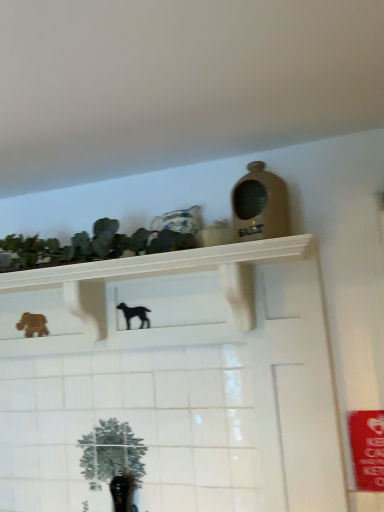
Where is `white glossy shelf at upper center`? The height and width of the screenshot is (512, 384). white glossy shelf at upper center is located at coordinates (144, 298).

What do you see at coordinates (134, 314) in the screenshot? Image resolution: width=384 pixels, height=512 pixels. I see `black matte dog at center, which is counted as the first animal, starting from the front` at bounding box center [134, 314].

What is the approximate width of green matte cactus at upper left?

The width of green matte cactus at upper left is 16.89 centimeters.

At what (x,y) coordinates should I click in order to perform the action: click on white glossy shelf at upper center. Please return your answer as a coordinate pair (x, y). Looking at the image, I should click on (144, 298).

Is black matte dog at center, the 2th animal positioned from the left, placed right next to wooden horse at left, the second animal in the front-to-back sequence?

black matte dog at center, the 2th animal positioned from the left, is not next to wooden horse at left, the second animal in the front-to-back sequence, and they're not touching.

Does black matte dog at center, the 2th animal positioned from the left, appear on the left side of wooden horse at left, which ranks as the 1th animal in left-to-right order?

No.

From a real-world perspective, between black matte dog at center, which appears as the 1th animal when viewed from the right, and wooden horse at left, which is the 1th animal in back-to-front order, who is vertically higher?

black matte dog at center, which appears as the 1th animal when viewed from the right.

Where is `animal on the left of black matte dog at center, which appears as the 1th animal when viewed from the right`? The width and height of the screenshot is (384, 512). animal on the left of black matte dog at center, which appears as the 1th animal when viewed from the right is located at coordinates (33, 325).

Does point (125, 304) come closer to viewer compared to point (141, 231)?

Yes, it is in front of point (141, 231).

How many degrees apart are the facing directions of black matte dog at center, which appears as the 1th animal when viewed from the right, and green matte cactus at upper left?

1.86 degrees.

Is black matte dog at center, which is counted as the first animal, starting from the front, bigger than green matte cactus at upper left?

No.

Who is more distant, black matte dog at center, which appears as the 1th animal when viewed from the right, or green matte cactus at upper left?

black matte dog at center, which appears as the 1th animal when viewed from the right, is more distant.

Considering the sizes of objects wooden horse at left, the 2th animal viewed from the right, and black matte dog at center, which is counted as the first animal, starting from the front, in the image provided, who is smaller, wooden horse at left, the 2th animal viewed from the right, or black matte dog at center, which is counted as the first animal, starting from the front,?

black matte dog at center, which is counted as the first animal, starting from the front, is smaller.

From a real-world perspective, is wooden horse at left, the second animal in the front-to-back sequence, located beneath black matte dog at center, which is the second animal from back to front?

Yes.

Considering the sizes of wooden horse at left, the second animal in the front-to-back sequence, and black matte dog at center, which appears as the 1th animal when viewed from the right, in the image, is wooden horse at left, the second animal in the front-to-back sequence, wider or thinner than black matte dog at center, which appears as the 1th animal when viewed from the right,?

wooden horse at left, the second animal in the front-to-back sequence, is wider than black matte dog at center, which appears as the 1th animal when viewed from the right.

Does wooden horse at left, the 2th animal viewed from the right, turn towards black matte dog at center, which is counted as the first animal, starting from the front?

No, wooden horse at left, the 2th animal viewed from the right, is not turned towards black matte dog at center, which is counted as the first animal, starting from the front.

Which is in front, point (49, 246) or point (38, 332)?

The point (49, 246) is closer to the camera.

Measure the distance from green matte cactus at upper left to wooden horse at left, the second animal in the front-to-back sequence.

green matte cactus at upper left is 14.15 inches from wooden horse at left, the second animal in the front-to-back sequence.

Is green matte cactus at upper left smaller than wooden horse at left, the second animal in the front-to-back sequence?

No.

Consider the image. Is green matte cactus at upper left spatially inside wooden horse at left, which is the 1th animal in back-to-front order, or outside of it?

green matte cactus at upper left is outside wooden horse at left, which is the 1th animal in back-to-front order.

Is white glossy shelf at upper center at the back of black matte dog at center, which appears as the 1th animal when viewed from the right?

No.

Is black matte dog at center, which is counted as the first animal, starting from the front, directly adjacent to white glossy shelf at upper center?

No, black matte dog at center, which is counted as the first animal, starting from the front, is not next to white glossy shelf at upper center.

Based on their positions, is black matte dog at center, which appears as the 1th animal when viewed from the right, located to the left or right of white glossy shelf at upper center?

Based on their positions, black matte dog at center, which appears as the 1th animal when viewed from the right, is located to the right of white glossy shelf at upper center.

Between black matte dog at center, the 2th animal positioned from the left, and white glossy shelf at upper center, which one is positioned behind?

Positioned behind is black matte dog at center, the 2th animal positioned from the left.

I want to click on shelf in front of the black matte dog at center, which appears as the 1th animal when viewed from the right, so click(144, 298).

Could you measure the distance between white glossy shelf at upper center and black matte dog at center, which is the second animal from back to front?

A distance of 21.37 centimeters exists between white glossy shelf at upper center and black matte dog at center, which is the second animal from back to front.

Which is more to the right, white glossy shelf at upper center or black matte dog at center, the 2th animal positioned from the left?

black matte dog at center, the 2th animal positioned from the left, is more to the right.

Is white glossy shelf at upper center facing away from black matte dog at center, which is counted as the first animal, starting from the front?

Yes, white glossy shelf at upper center's orientation is away from black matte dog at center, which is counted as the first animal, starting from the front.

From a real-world perspective, between white glossy shelf at upper center and wooden horse at left, the second animal in the front-to-back sequence, who is vertically higher?

In real-world perspective, white glossy shelf at upper center is above.

Based on the photo, is white glossy shelf at upper center wider than wooden horse at left, the 2th animal viewed from the right?

Yes, white glossy shelf at upper center is wider than wooden horse at left, the 2th animal viewed from the right.

From the image's perspective, is white glossy shelf at upper center located beneath wooden horse at left, which ranks as the 1th animal in left-to-right order?

No.

Can you confirm if white glossy shelf at upper center is smaller than wooden horse at left, which is the 1th animal in back-to-front order?

No.

I want to click on animal that is on the left side of black matte dog at center, which appears as the 1th animal when viewed from the right, so click(33, 325).

Identify the location of collection above the black matte dog at center, which appears as the 1th animal when viewed from the right (from the image's perspective). The width and height of the screenshot is (384, 512). pos(89,246).

In the scene shown: Based on their spatial positions, is green matte cactus at upper left or wooden horse at left, the 2th animal viewed from the right, further from white glossy shelf at upper center?

wooden horse at left, the 2th animal viewed from the right, is further to white glossy shelf at upper center.

Estimate the real-world distances between objects in this image. Which object is further from black matte dog at center, the 2th animal positioned from the left, white glossy shelf at upper center or green matte cactus at upper left?

The object further to black matte dog at center, the 2th animal positioned from the left, is green matte cactus at upper left.

From the image, which object appears to be farther from white glossy shelf at upper center, wooden horse at left, which ranks as the 1th animal in left-to-right order, or black matte dog at center, the 2th animal positioned from the left?

Among the two, wooden horse at left, which ranks as the 1th animal in left-to-right order, is located further to white glossy shelf at upper center.

Looking at this image, considering their positions, is white glossy shelf at upper center positioned further to black matte dog at center, which appears as the 1th animal when viewed from the right, than wooden horse at left, which ranks as the 1th animal in left-to-right order?

Based on the image, wooden horse at left, which ranks as the 1th animal in left-to-right order, appears to be further to black matte dog at center, which appears as the 1th animal when viewed from the right.

Considering their positions, is wooden horse at left, which is the 1th animal in back-to-front order, positioned further to green matte cactus at upper left than black matte dog at center, which appears as the 1th animal when viewed from the right?

wooden horse at left, which is the 1th animal in back-to-front order, is further to green matte cactus at upper left.

Considering their positions, is white glossy shelf at upper center positioned closer to green matte cactus at upper left than wooden horse at left, which ranks as the 1th animal in left-to-right order?

white glossy shelf at upper center lies closer to green matte cactus at upper left than the other object.

Which object lies further to the anchor point white glossy shelf at upper center, black matte dog at center, the 2th animal positioned from the left, or wooden horse at left, which is the 1th animal in back-to-front order?

Based on the image, wooden horse at left, which is the 1th animal in back-to-front order, appears to be further to white glossy shelf at upper center.

When comparing their distances from green matte cactus at upper left, does white glossy shelf at upper center or black matte dog at center, which is the second animal from back to front, seem closer?

Based on the image, white glossy shelf at upper center appears to be nearer to green matte cactus at upper left.

Identify the location of collection between white glossy shelf at upper center and wooden horse at left, which ranks as the 1th animal in left-to-right order, along the z-axis. Image resolution: width=384 pixels, height=512 pixels. (89, 246).

Locate an element on the screen. animal between white glossy shelf at upper center and wooden horse at left, which is the 1th animal in back-to-front order, in the front-back direction is located at coordinates [134, 314].

This screenshot has width=384, height=512. Find the location of `collection between white glossy shelf at upper center and black matte dog at center, the 2th animal positioned from the left, from front to back`. collection between white glossy shelf at upper center and black matte dog at center, the 2th animal positioned from the left, from front to back is located at coordinates (89, 246).

Image resolution: width=384 pixels, height=512 pixels. What are the coordinates of `animal positioned between green matte cactus at upper left and wooden horse at left, the second animal in the front-to-back sequence, from near to far` in the screenshot? It's located at (134, 314).